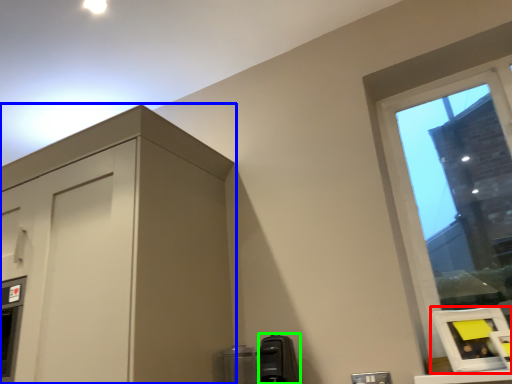
Question: Considering the real-world distances, which object is farthest from picture frame (highlighted by a red box)? dresser (highlighted by a blue box) or appliance (highlighted by a green box)?

Choices:
 (A) dresser
 (B) appliance

Answer: (A)